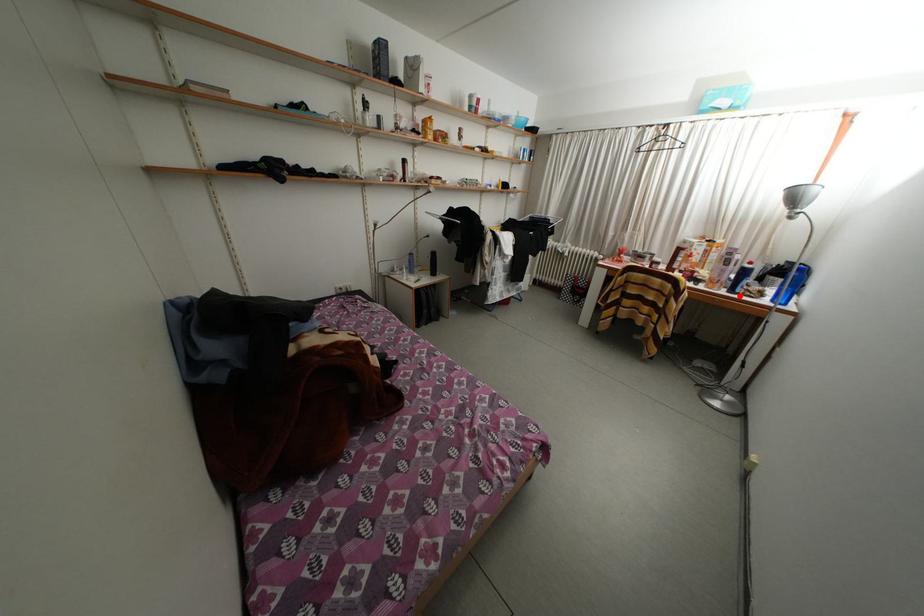
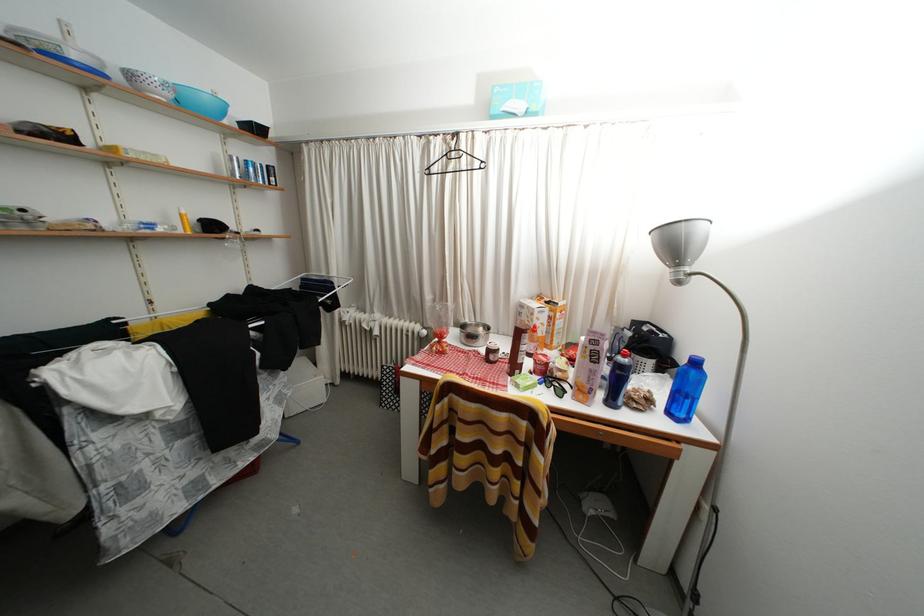
Question: I am providing you with two images of the same scene from different viewpoints. Image1 has a red point marked. In image2, the corresponding 3D location appears at what relative position? Reply with the corresponding letter.

Choices:
 (A) Closer
 (B) Farther

Answer: (B)